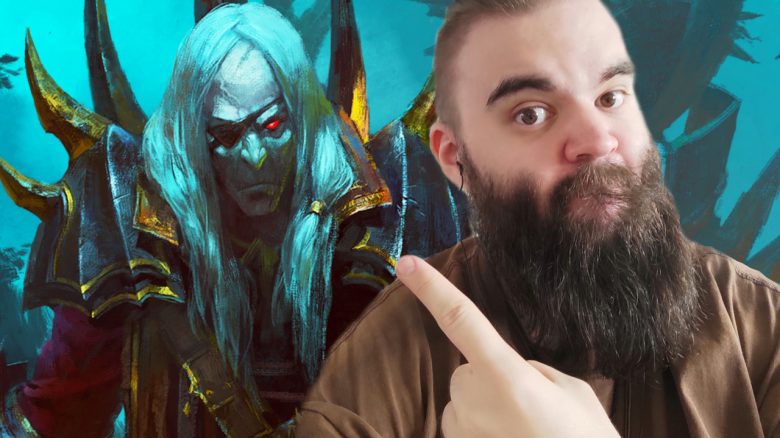
Identify the location of gold trim. The width and height of the screenshot is (780, 438). (69, 199), (52, 265), (86, 283), (140, 263), (161, 289), (104, 303), (72, 300), (367, 230), (381, 251), (362, 279).